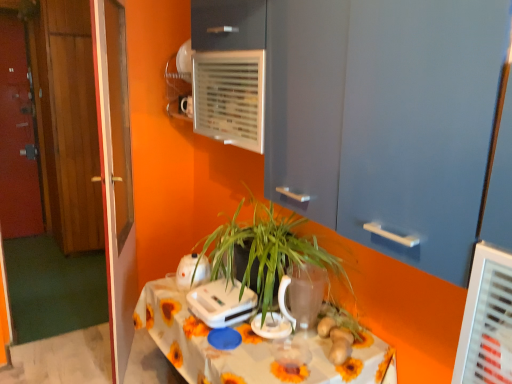
Question: Can you confirm if wooden door at left, which is the second door from right to left, is thinner than white plastic appliance at center, the second appliance from the left?

Choices:
 (A) no
 (B) yes

Answer: (B)

Question: Is wooden door at left, acting as the 3th door starting from the left, oriented towards white plastic appliance at center, the 2th appliance positioned from the right?

Choices:
 (A) yes
 (B) no

Answer: (A)

Question: Considering the relative sizes of wooden door at left, placed as the third door when sorted from back to front, and white plastic appliance at center, the 2th appliance positioned from the right, in the image provided, is wooden door at left, placed as the third door when sorted from back to front, bigger than white plastic appliance at center, the 2th appliance positioned from the right,?

Choices:
 (A) yes
 (B) no

Answer: (A)

Question: From the image's perspective, does wooden door at left, placed as the third door when sorted from back to front, appear higher than white plastic appliance at center, the 2th appliance positioned from the right?

Choices:
 (A) no
 (B) yes

Answer: (B)

Question: Does wooden door at left, which is the second door from right to left, appear on the left side of white plastic appliance at center, the second appliance from the left?

Choices:
 (A) yes
 (B) no

Answer: (A)

Question: Looking at their shapes, would you say brown matte ginger at center is wider or thinner than white plastic toaster at center, the 1th appliance from the left?

Choices:
 (A) thin
 (B) wide

Answer: (A)

Question: Is point (334, 357) positioned closer to the camera than point (197, 279)?

Choices:
 (A) closer
 (B) farther

Answer: (A)

Question: Is brown matte ginger at center in front of or behind white plastic toaster at center, the 1th appliance from the left, in the image?

Choices:
 (A) front
 (B) behind

Answer: (A)

Question: Visually, is brown matte ginger at center positioned to the left or to the right of white plastic toaster at center, which is counted as the third appliance, starting from the right?

Choices:
 (A) right
 (B) left

Answer: (A)

Question: Choose the correct answer: Is transparent glass door at left inside white plastic appliance at center, the 2th appliance positioned from the right, or outside it?

Choices:
 (A) inside
 (B) outside

Answer: (B)

Question: From the image's perspective, is transparent glass door at left located above or below white plastic appliance at center, the second appliance from the left?

Choices:
 (A) below
 (B) above

Answer: (B)

Question: Is transparent glass door at left taller or shorter than white plastic appliance at center, the 2th appliance positioned from the right?

Choices:
 (A) short
 (B) tall

Answer: (B)

Question: In the image, is transparent glass door at left positioned in front of or behind white plastic appliance at center, the second appliance from the left?

Choices:
 (A) front
 (B) behind

Answer: (B)

Question: In terms of width, does brown matte ginger at center look wider or thinner when compared to white floral tablecloth at center?

Choices:
 (A) wide
 (B) thin

Answer: (B)

Question: Visually, is brown matte ginger at center positioned to the left or to the right of white floral tablecloth at center?

Choices:
 (A) left
 (B) right

Answer: (B)